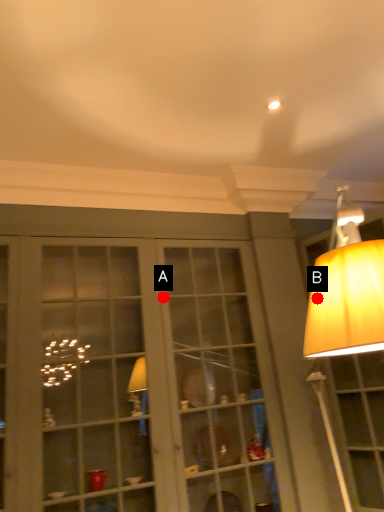
Question: Two points are circled on the image, labeled by A and B beside each circle. Which point is further to the camera?

Choices:
 (A) A is further
 (B) B is further

Answer: (A)